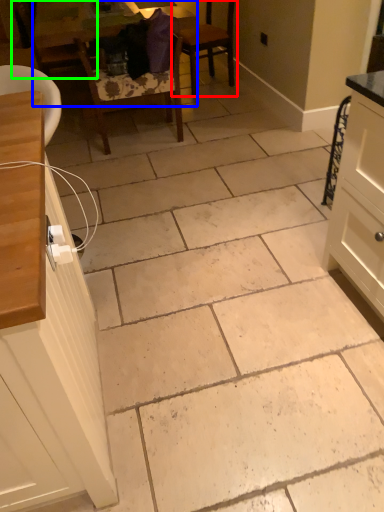
Question: Estimate the real-world distances between objects in this image. Which object is closer to chair (highlighted by a red box), table (highlighted by a blue box) or chair (highlighted by a green box)?

Choices:
 (A) table
 (B) chair

Answer: (A)